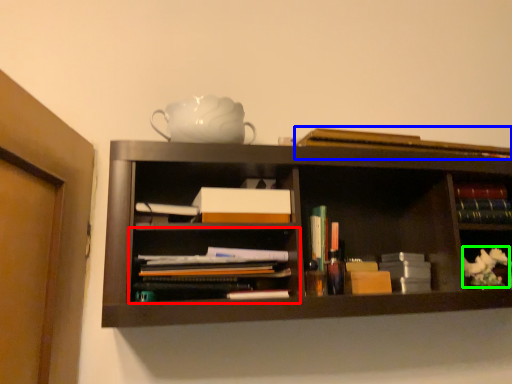
Question: Which is nearer to the shelf (highlighted by a red box)? book (highlighted by a blue box) or flower (highlighted by a green box).

Choices:
 (A) book
 (B) flower

Answer: (A)